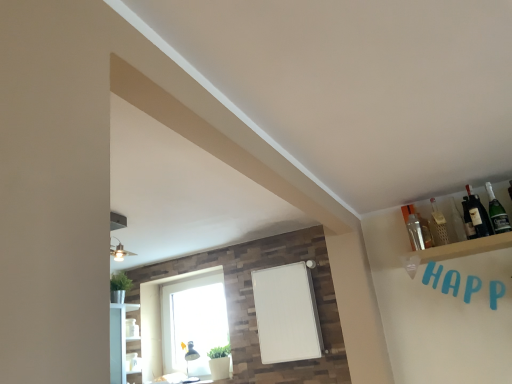
This screenshot has width=512, height=384. Find the location of `white glass window at lower center`. white glass window at lower center is located at coordinates (166, 315).

Image resolution: width=512 pixels, height=384 pixels. What do you see at coordinates (468, 220) in the screenshot?
I see `matte glass bottle at upper right, marked as the third bottle in a left-to-right arrangement` at bounding box center [468, 220].

This screenshot has height=384, width=512. What do you see at coordinates (438, 225) in the screenshot? I see `clear glass bottle at upper right, arranged as the second bottle when viewed from the left` at bounding box center [438, 225].

Measure the distance between dark glass bottle at upper right, the 4th bottle from the left, and camera.

The distance of dark glass bottle at upper right, the 4th bottle from the left, from camera is 2.45 meters.

Image resolution: width=512 pixels, height=384 pixels. What do you see at coordinates (497, 212) in the screenshot? I see `green glass bottle at upper right, which is the 5th bottle from left to right` at bounding box center [497, 212].

I want to click on white glass window at lower center, so click(166, 315).

From the image's perspective, relative to dark glass bottle at upper right, the 4th bottle from the left, is white glass window at lower center above or below?

white glass window at lower center is below dark glass bottle at upper right, the 4th bottle from the left.

Does point (143, 308) come closer to viewer compared to point (477, 212)?

No, (143, 308) is further to viewer.

From a real-world perspective, between white glass window at lower center and dark glass bottle at upper right, the 4th bottle from the left, who is vertically higher?

From a 3D spatial view, dark glass bottle at upper right, the 4th bottle from the left, is above.

Is white glass window at lower center aimed at dark glass bottle at upper right, positioned as the second bottle in right-to-left order?

No, white glass window at lower center is not oriented towards dark glass bottle at upper right, positioned as the second bottle in right-to-left order.

Is there a large distance between matte glass bottle at upper right, marked as the third bottle in a left-to-right arrangement, and dark glass bottle at upper right, positioned as the second bottle in right-to-left order?

matte glass bottle at upper right, marked as the third bottle in a left-to-right arrangement, is actually quite close to dark glass bottle at upper right, positioned as the second bottle in right-to-left order.

Is matte glass bottle at upper right, positioned as the 3th bottle in right-to-left order, shorter than dark glass bottle at upper right, positioned as the second bottle in right-to-left order?

Yes.

Considering the positions of objects matte glass bottle at upper right, marked as the third bottle in a left-to-right arrangement, and dark glass bottle at upper right, the 4th bottle from the left, in the image provided, who is more to the left, matte glass bottle at upper right, marked as the third bottle in a left-to-right arrangement, or dark glass bottle at upper right, the 4th bottle from the left,?

Positioned to the left is matte glass bottle at upper right, marked as the third bottle in a left-to-right arrangement.

Starting from the matte glass bottle at upper right, positioned as the 3th bottle in right-to-left order, which bottle is the 2nd one to the right? Please provide its 2D coordinates.

[(497, 212)]

Considering the points (469, 225) and (496, 207), which point is in front, point (469, 225) or point (496, 207)?

Positioned in front is point (469, 225).

From the image's perspective, which object appears higher, clear glass bottle at upper right, which appears as the 5th bottle when viewed from the right, or white glass window at lower center?

clear glass bottle at upper right, which appears as the 5th bottle when viewed from the right, from the image's perspective.

From a real-world perspective, between clear glass bottle at upper right, placed as the 1th bottle when sorted from left to right, and white glass window at lower center, who is vertically higher?

clear glass bottle at upper right, placed as the 1th bottle when sorted from left to right, from a real-world perspective.

How many degrees apart are the facing directions of clear glass bottle at upper right, placed as the 1th bottle when sorted from left to right, and white glass window at lower center?

0.737 degrees.

Image resolution: width=512 pixels, height=384 pixels. I want to click on bottle on the right of dark glass bottle at upper right, positioned as the second bottle in right-to-left order, so click(x=497, y=212).

Would you say green glass bottle at upper right, which is the first bottle from right to left, is inside or outside dark glass bottle at upper right, positioned as the second bottle in right-to-left order?

green glass bottle at upper right, which is the first bottle from right to left, cannot be found inside dark glass bottle at upper right, positioned as the second bottle in right-to-left order.

Can you tell me how much green glass bottle at upper right, which is the first bottle from right to left, and dark glass bottle at upper right, positioned as the second bottle in right-to-left order, differ in facing direction?

The angle between the facing direction of green glass bottle at upper right, which is the first bottle from right to left, and the facing direction of dark glass bottle at upper right, positioned as the second bottle in right-to-left order, is 0.00139 degrees.

From the image's perspective, which one is positioned lower, green glass bottle at upper right, which is the first bottle from right to left, or dark glass bottle at upper right, the 4th bottle from the left?

dark glass bottle at upper right, the 4th bottle from the left.

Which of these two, matte glass bottle at upper right, positioned as the 3th bottle in right-to-left order, or clear glass bottle at upper right, the 4th bottle viewed from the right, stands shorter?

Standing shorter between the two is matte glass bottle at upper right, positioned as the 3th bottle in right-to-left order.

Is matte glass bottle at upper right, marked as the third bottle in a left-to-right arrangement, to the right of clear glass bottle at upper right, the 4th bottle viewed from the right, from the viewer's perspective?

Indeed, matte glass bottle at upper right, marked as the third bottle in a left-to-right arrangement, is positioned on the right side of clear glass bottle at upper right, the 4th bottle viewed from the right.

Would you say matte glass bottle at upper right, marked as the third bottle in a left-to-right arrangement, is inside or outside clear glass bottle at upper right, the 4th bottle viewed from the right?

matte glass bottle at upper right, marked as the third bottle in a left-to-right arrangement, is located beyond the bounds of clear glass bottle at upper right, the 4th bottle viewed from the right.

In the scene shown: Is there a large distance between matte glass bottle at upper right, positioned as the 3th bottle in right-to-left order, and clear glass bottle at upper right, the 4th bottle viewed from the right?

matte glass bottle at upper right, positioned as the 3th bottle in right-to-left order, is near clear glass bottle at upper right, the 4th bottle viewed from the right, not far away.

From the picture: From a real-world perspective, is clear glass bottle at upper right, placed as the 1th bottle when sorted from left to right, on top of dark glass bottle at upper right, the 4th bottle from the left?

No.

Is point (411, 241) positioned before point (471, 195)?

No, it is behind (471, 195).

Is clear glass bottle at upper right, which appears as the 5th bottle when viewed from the right, positioned far away from dark glass bottle at upper right, the 4th bottle from the left?

No, clear glass bottle at upper right, which appears as the 5th bottle when viewed from the right, is in close proximity to dark glass bottle at upper right, the 4th bottle from the left.

Locate an element on the screen. The width and height of the screenshot is (512, 384). window below the dark glass bottle at upper right, the 4th bottle from the left (from a real-world perspective) is located at coordinates (166, 315).

There is a matte glass bottle at upper right, marked as the third bottle in a left-to-right arrangement. Where is `the 1st bottle above it (from the image's perspective)`? This screenshot has width=512, height=384. the 1st bottle above it (from the image's perspective) is located at coordinates (478, 215).

Which object lies further to the anchor point green glass bottle at upper right, which is the 5th bottle from left to right, white glass window at lower center or dark glass bottle at upper right, positioned as the second bottle in right-to-left order?

white glass window at lower center is positioned further to the anchor green glass bottle at upper right, which is the 5th bottle from left to right.

Consider the image. When comparing their distances from matte glass bottle at upper right, positioned as the 3th bottle in right-to-left order, does green glass bottle at upper right, which is the 5th bottle from left to right, or white glass window at lower center seem closer?

Among the two, green glass bottle at upper right, which is the 5th bottle from left to right, is located nearer to matte glass bottle at upper right, positioned as the 3th bottle in right-to-left order.

From the image, which object appears to be farther from white glass window at lower center, dark glass bottle at upper right, the 4th bottle from the left, or clear glass bottle at upper right, arranged as the second bottle when viewed from the left?

dark glass bottle at upper right, the 4th bottle from the left, is further to white glass window at lower center.

Which object lies nearer to the anchor point matte glass bottle at upper right, marked as the third bottle in a left-to-right arrangement, clear glass bottle at upper right, placed as the 1th bottle when sorted from left to right, or green glass bottle at upper right, which is the first bottle from right to left?

green glass bottle at upper right, which is the first bottle from right to left, lies closer to matte glass bottle at upper right, marked as the third bottle in a left-to-right arrangement, than the other object.

Estimate the real-world distances between objects in this image. Which object is closer to dark glass bottle at upper right, positioned as the second bottle in right-to-left order, green glass bottle at upper right, which is the first bottle from right to left, or matte glass bottle at upper right, marked as the third bottle in a left-to-right arrangement?

Based on the image, matte glass bottle at upper right, marked as the third bottle in a left-to-right arrangement, appears to be nearer to dark glass bottle at upper right, positioned as the second bottle in right-to-left order.

Which object lies nearer to the anchor point white glass window at lower center, clear glass bottle at upper right, which appears as the 5th bottle when viewed from the right, or clear glass bottle at upper right, arranged as the second bottle when viewed from the left?

clear glass bottle at upper right, which appears as the 5th bottle when viewed from the right, is positioned closer to the anchor white glass window at lower center.

Looking at the image, which one is located further to white glass window at lower center, green glass bottle at upper right, which is the first bottle from right to left, or dark glass bottle at upper right, positioned as the second bottle in right-to-left order?

green glass bottle at upper right, which is the first bottle from right to left.

When comparing their distances from clear glass bottle at upper right, arranged as the second bottle when viewed from the left, does dark glass bottle at upper right, the 4th bottle from the left, or clear glass bottle at upper right, which appears as the 5th bottle when viewed from the right, seem further?

dark glass bottle at upper right, the 4th bottle from the left, is further to clear glass bottle at upper right, arranged as the second bottle when viewed from the left.

The image size is (512, 384). What are the coordinates of `bottle situated between white glass window at lower center and clear glass bottle at upper right, the 4th bottle viewed from the right, from left to right` in the screenshot? It's located at (415, 232).

Find the location of `bottle between clear glass bottle at upper right, arranged as the second bottle when viewed from the left, and dark glass bottle at upper right, the 4th bottle from the left`. bottle between clear glass bottle at upper right, arranged as the second bottle when viewed from the left, and dark glass bottle at upper right, the 4th bottle from the left is located at coordinates (468, 220).

Locate an element on the screen. bottle between matte glass bottle at upper right, marked as the third bottle in a left-to-right arrangement, and green glass bottle at upper right, which is the first bottle from right to left, in the horizontal direction is located at coordinates (478, 215).

Identify the location of bottle between clear glass bottle at upper right, placed as the 1th bottle when sorted from left to right, and matte glass bottle at upper right, positioned as the 3th bottle in right-to-left order, in the horizontal direction. Image resolution: width=512 pixels, height=384 pixels. (438, 225).